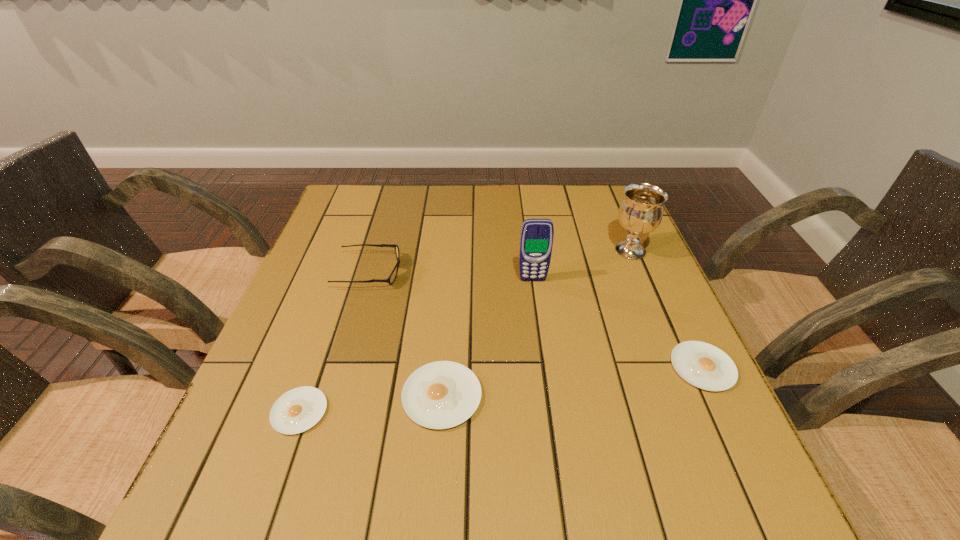
Locate an element on the screen. the shortest egg yolk is located at coordinates (299, 409).

The width and height of the screenshot is (960, 540). I want to click on the shortest object, so click(x=299, y=409).

This screenshot has height=540, width=960. What are the coordinates of `the second egg yolk from left to right` in the screenshot? It's located at (443, 394).

The image size is (960, 540). What are the coordinates of `the third shortest object` in the screenshot? It's located at (443, 394).

The width and height of the screenshot is (960, 540). Identify the location of the rightmost egg yolk. (703, 365).

You are a GUI agent. You are given a task and a screenshot of the screen. Output one action in this format:
    pyautogui.click(x=<x>, y=<y>)
    Task: Click on the second shortest egg yolk
    The image size is (960, 540).
    Given the screenshot: What is the action you would take?
    pyautogui.click(x=703, y=365)

You are a GUI agent. You are given a task and a screenshot of the screen. Output one action in this format:
    pyautogui.click(x=<x>, y=<y>)
    Task: Click on the chalice
    The height and width of the screenshot is (540, 960).
    Given the screenshot: What is the action you would take?
    pyautogui.click(x=641, y=211)

Identify the location of the third tallest object. (393, 275).

The width and height of the screenshot is (960, 540). What are the coordinates of `the fourth object from left to right` in the screenshot? It's located at (536, 241).

Identify the location of free spot located on the back of the shortest egg yolk. (327, 330).